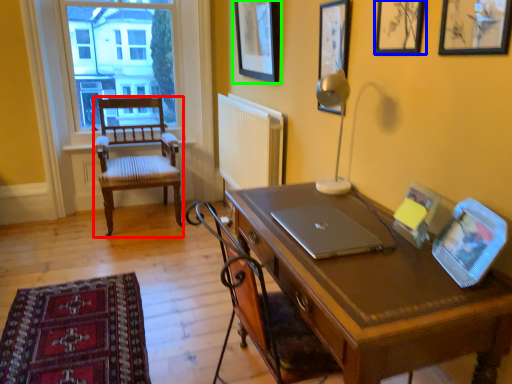
Question: Which object is positioned farthest from chair (highlighted by a red box)? Select from picture frame (highlighted by a blue box) and picture frame (highlighted by a green box).

Choices:
 (A) picture frame
 (B) picture frame

Answer: (A)